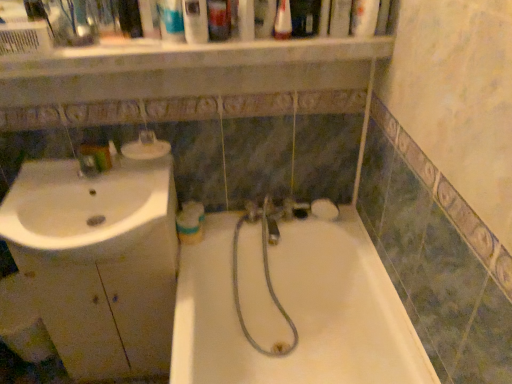
Question: Is the depth of translucent plastic soap dispenser at upper center, positioned as the 1th toiletry in top-to-bottom order, less than that of white glossy bathtub at center?

Choices:
 (A) yes
 (B) no

Answer: (B)

Question: From the image's perspective, would you say translucent plastic soap dispenser at upper center, marked as the 1th toiletry in a front-to-back arrangement, is shown under white glossy bathtub at center?

Choices:
 (A) no
 (B) yes

Answer: (A)

Question: Is white glossy bathtub at center surrounded by translucent plastic soap dispenser at upper center, the 2th toiletry from the left?

Choices:
 (A) yes
 (B) no

Answer: (B)

Question: Would you say translucent plastic soap dispenser at upper center, positioned as the second toiletry in bottom-to-top order, is outside white glossy bathtub at center?

Choices:
 (A) no
 (B) yes

Answer: (B)

Question: In the image, is clear plastic bottle at upper center, which appears as the second mouthwash when viewed from the front, on the left side or the right side of matte plastic container at upper left, which is the first toiletry from bottom to top?

Choices:
 (A) right
 (B) left

Answer: (A)

Question: Considering the positions of point (280, 19) and point (113, 148), is point (280, 19) closer or farther from the camera than point (113, 148)?

Choices:
 (A) farther
 (B) closer

Answer: (B)

Question: From a real-world perspective, is clear plastic bottle at upper center, which is counted as the 1th mouthwash, starting from the right, physically located above or below matte plastic container at upper left, the second toiletry from the front?

Choices:
 (A) below
 (B) above

Answer: (B)

Question: From the image's perspective, is clear plastic bottle at upper center, which appears as the 1th mouthwash when viewed from the top, positioned above or below matte plastic container at upper left, which is counted as the 1th toiletry, starting from the back?

Choices:
 (A) below
 (B) above

Answer: (B)

Question: Looking at the image, does matte plastic container at upper left, which is the first toiletry from bottom to top, seem bigger or smaller compared to clear plastic bottle at upper center, which is the third mouthwash in back-to-front order?

Choices:
 (A) small
 (B) big

Answer: (A)

Question: Based on their positions, is matte plastic container at upper left, which is the first toiletry from bottom to top, located to the left or right of clear plastic bottle at upper center, which appears as the 1th mouthwash when viewed from the top?

Choices:
 (A) left
 (B) right

Answer: (A)

Question: From the image's perspective, relative to clear plastic bottle at upper center, which appears as the second mouthwash when viewed from the front, is matte plastic container at upper left, the second toiletry from the front, above or below?

Choices:
 (A) above
 (B) below

Answer: (B)

Question: Is matte plastic container at upper left, the second toiletry from the front, wider or thinner than clear plastic bottle at upper center, which is the third mouthwash in back-to-front order?

Choices:
 (A) thin
 (B) wide

Answer: (A)

Question: From a real-world perspective, is white glossy mouthwash at center, arranged as the 4th mouthwash when viewed from the right, physically located above or below clear plastic bottle at upper center, which is the third mouthwash in back-to-front order?

Choices:
 (A) below
 (B) above

Answer: (A)

Question: In the image, is white glossy mouthwash at center, arranged as the 4th mouthwash when viewed from the right, positioned in front of or behind clear plastic bottle at upper center, which appears as the second mouthwash when viewed from the front?

Choices:
 (A) behind
 (B) front

Answer: (A)